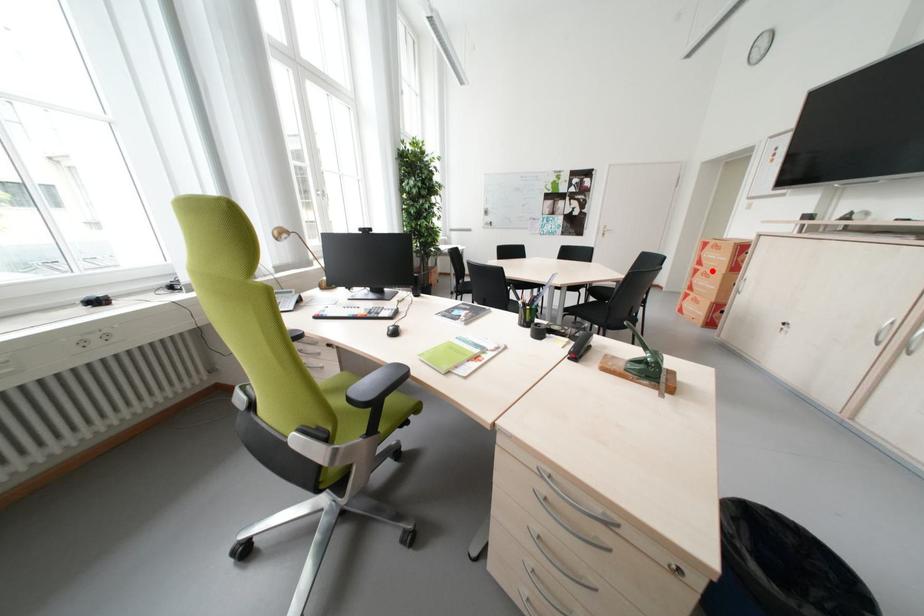
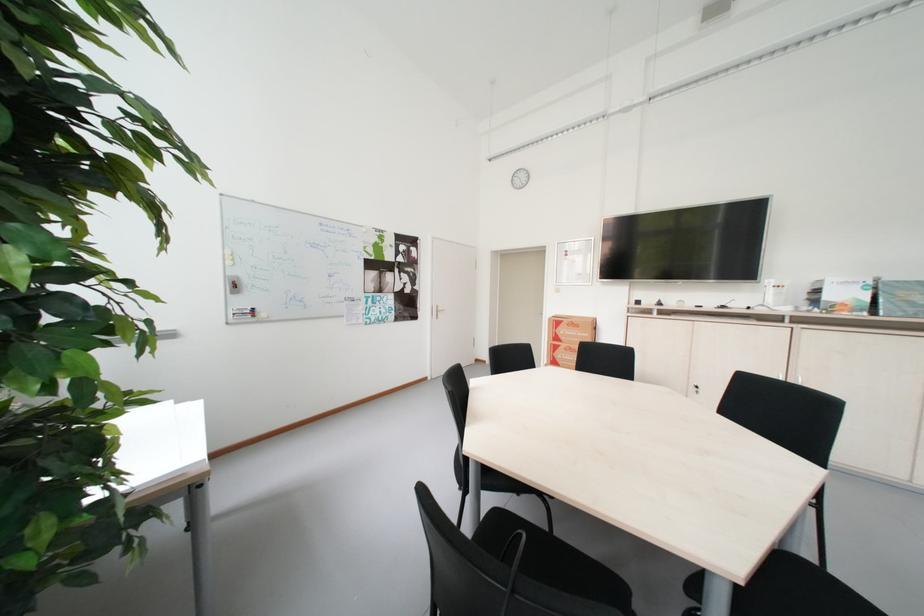
Question: I am providing you with two images of the same scene from different viewpoints. Image1 has a red point marked. In image2, the corresponding 3D location appears at what relative position? Reply with the corresponding letter.

Choices:
 (A) Closer
 (B) Farther

Answer: (B)